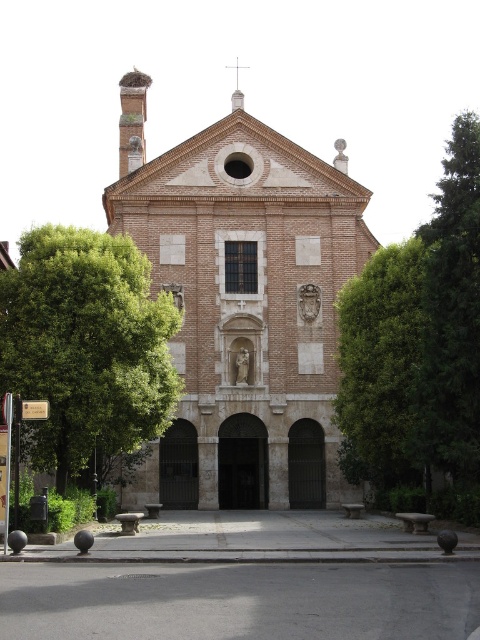
Is brown brick chapel at center taller than green leafy tree at right?

Correct, brown brick chapel at center is much taller as green leafy tree at right.

Can you confirm if brown brick chapel at center is wider than green leafy tree at right?

Correct, the width of brown brick chapel at center exceeds that of green leafy tree at right.

Is point (143, 465) less distant than point (425, 280)?

That is False.

The image size is (480, 640). I want to click on brown brick chapel at center, so click(x=242, y=305).

Image resolution: width=480 pixels, height=640 pixels. What do you see at coordinates (418, 353) in the screenshot? I see `green leafy tree at right` at bounding box center [418, 353].

Does green leafy tree at right appear under green leafy tree at center?

No.

What do you see at coordinates (418, 353) in the screenshot?
I see `green leafy tree at right` at bounding box center [418, 353].

Identify the location of green leafy tree at right. This screenshot has width=480, height=640. (418, 353).

Can you confirm if brown brick chapel at center is shorter than green leafy tree at center?

No, brown brick chapel at center is not shorter than green leafy tree at center.

Measure the distance between point (201, 326) and camera.

Point (201, 326) and camera are 84.18 meters apart from each other.

Where is `brown brick chapel at center`? brown brick chapel at center is located at coordinates (242, 305).